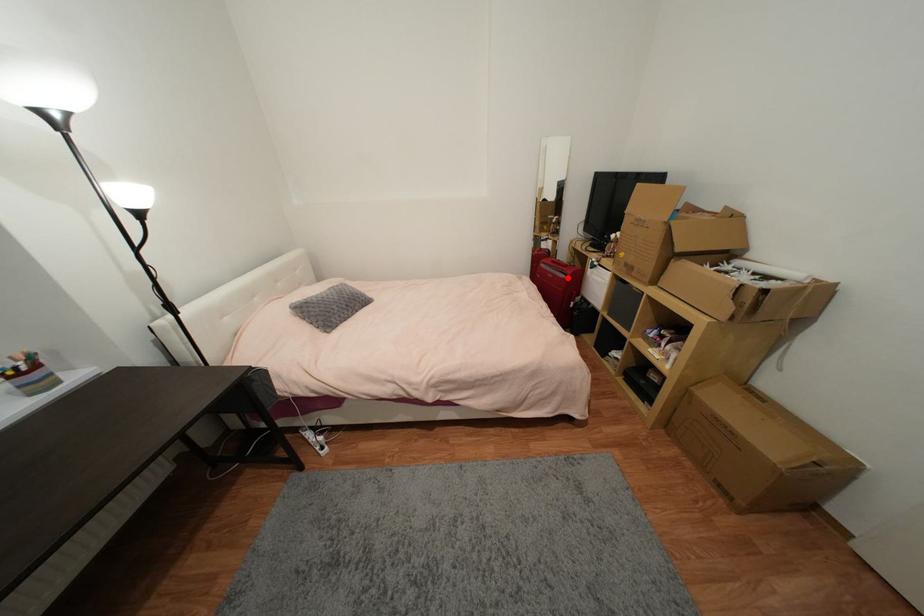
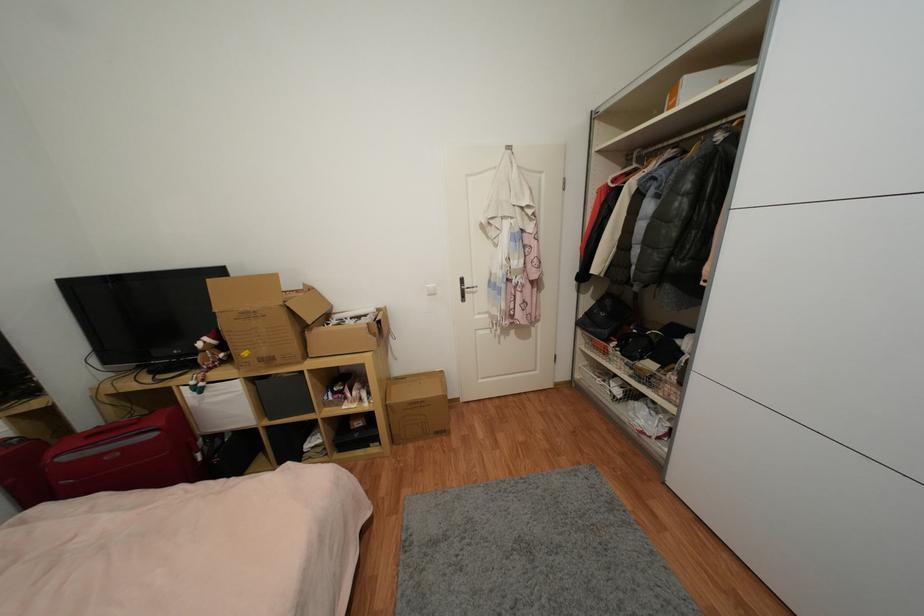
Question: I am providing you with two images of the same scene from different viewpoints. In image1, a red point is highlighted. Considering the same 3D point in image2, which of the following is correct?

Choices:
 (A) It is closer
 (B) It is farther

Answer: (B)